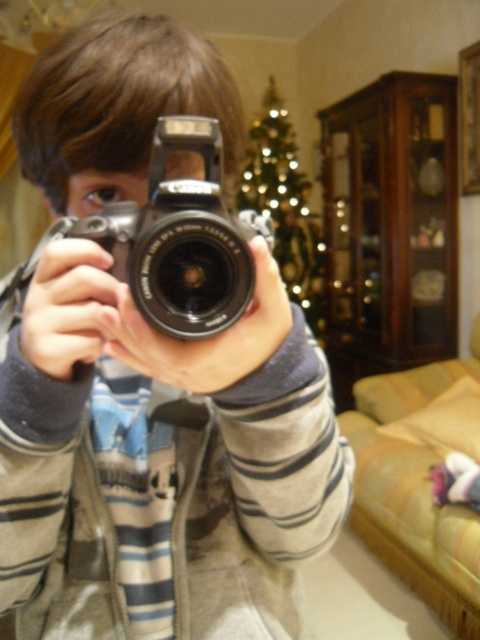
Question: Which point is closer to the camera?

Choices:
 (A) (219, 230)
 (B) (298, 177)
 (C) (151, 577)

Answer: (A)

Question: Does matte silver camera at center have a larger size compared to shiny gold christmas tree at center?

Choices:
 (A) no
 (B) yes

Answer: (A)

Question: Which object is farther from the camera taking this photo?

Choices:
 (A) matte silver camera at center
 (B) shiny gold christmas tree at center

Answer: (B)

Question: Is matte silver camera at center positioned at the back of silver metallic camera at center?

Choices:
 (A) yes
 (B) no

Answer: (A)

Question: Among these points, which one is nearest to the camera?

Choices:
 (A) (194, 211)
 (B) (304, 221)

Answer: (A)

Question: Can you confirm if silver metallic camera at center is positioned below shiny gold christmas tree at center?

Choices:
 (A) yes
 (B) no

Answer: (A)